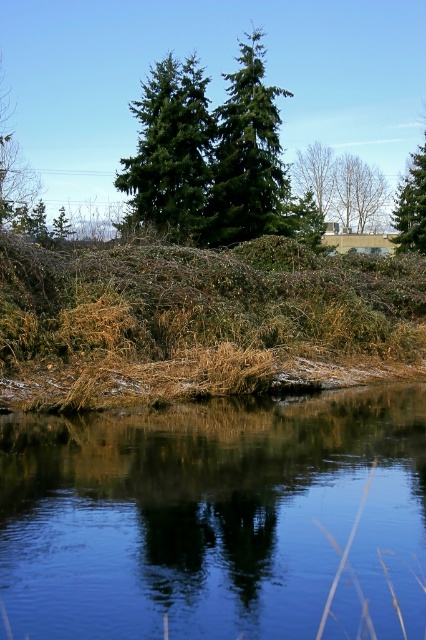
You are standing in the natural scene and want to take a photo of both the green matte evergreen tree at upper center and the green matte tree at upper right. Which tree should you focus on first to ensure both are in the frame?

You should focus on the green matte evergreen tree at upper center first since it is closer to the viewer, allowing both trees to be in the frame by adjusting the camera angle or zoom accordingly.

Based on the photo, you are a park ranger planning to install a fence between the green matte evergreen tree at upper center and the green matte tree at upper right. The fence needs to be at least 15 meters long to ensure safety. Based on the scene, will the fence be long enough?

The distance between the green matte evergreen tree at upper center and the green matte tree at upper right is 17.79 meters, so the fence of at least 15 meters will be sufficient as it exceeds the required length.

You are standing in the serene natural scene and want to take a photo of the green matte tree at center and the green matte tree at upper right. Which tree will appear larger in the photo?

The green matte tree at center will appear larger in the photo because it is closer to the viewer than the green matte tree at upper right.